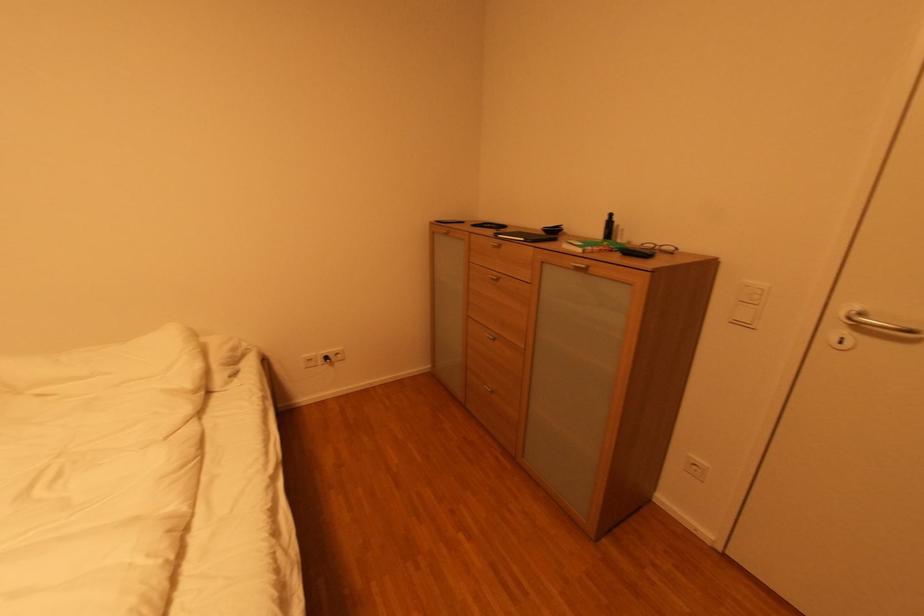
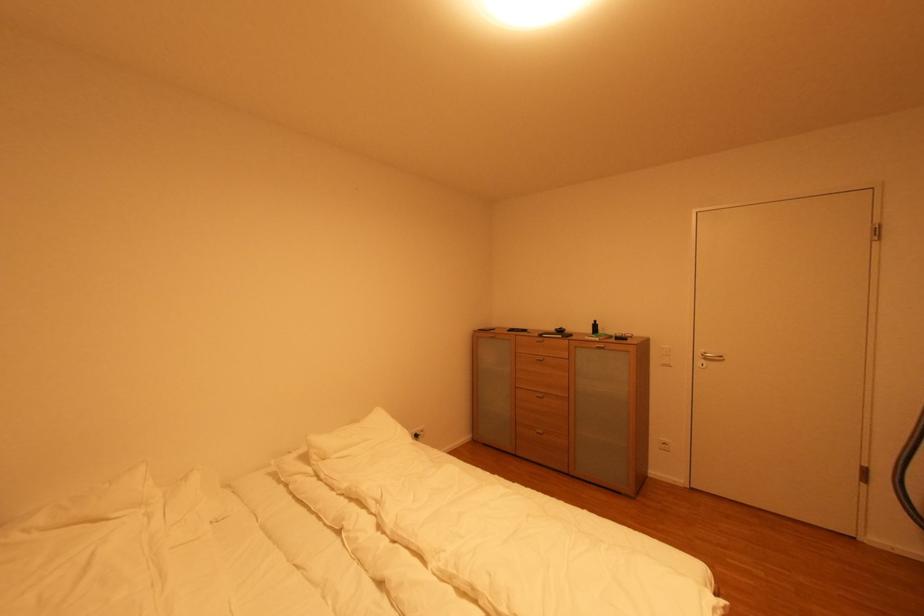
Which direction would the cameraman need to move to produce the second image?

The movement direction of the cameraman is left, backward.